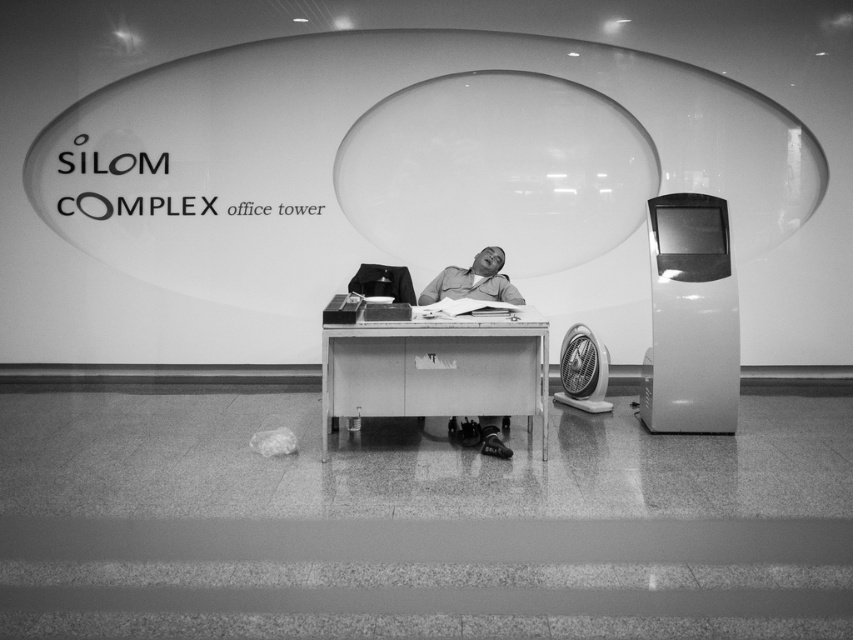
You are an office worker who needs to retrieve a document from the desk. There is a transparent glass bubble at upper center and a matte gray shirt at center on the desk. Which object is directly above the other?

The transparent glass bubble at upper center is positioned over matte gray shirt at center.